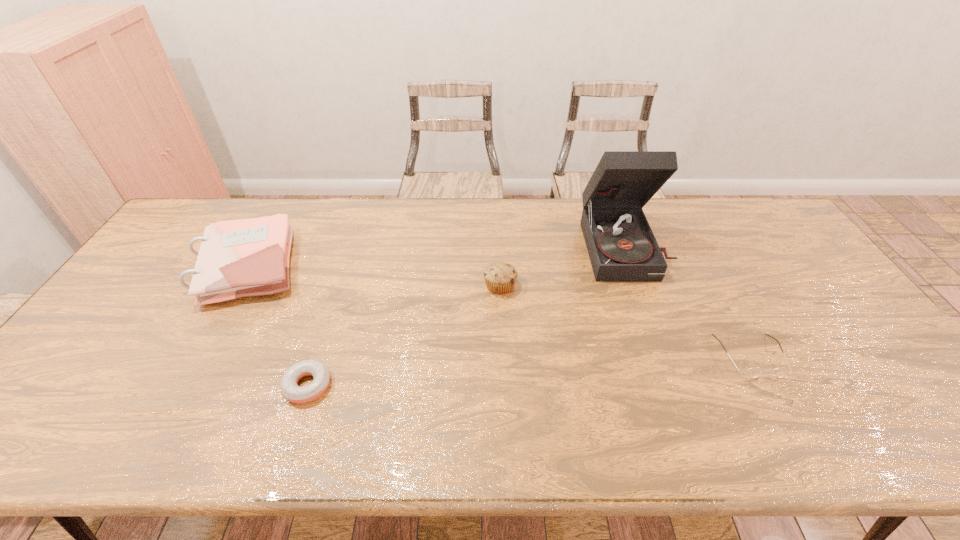
Locate an element on the screen. The width and height of the screenshot is (960, 540). the fourth closest object to the shortest object is located at coordinates (753, 372).

Find the location of a particular element. Image resolution: width=960 pixels, height=540 pixels. object that stands as the third closest to the phonebook is located at coordinates (621, 245).

This screenshot has height=540, width=960. Find the location of `vacant position in the image that satisfies the following two spatial constraints: 1. on the front side of the muffin; 2. on the left side of the phonebook`. vacant position in the image that satisfies the following two spatial constraints: 1. on the front side of the muffin; 2. on the left side of the phonebook is located at coordinates (237, 285).

Find the location of `vacant area in the image that satisfies the following two spatial constraints: 1. on the back side of the muffin; 2. on the right side of the doughnut`. vacant area in the image that satisfies the following two spatial constraints: 1. on the back side of the muffin; 2. on the right side of the doughnut is located at coordinates (340, 285).